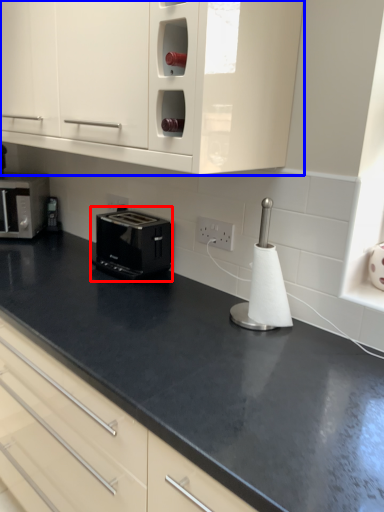
Question: Which object is further to the camera taking this photo, toaster (highlighted by a red box) or cabinetry (highlighted by a blue box)?

Choices:
 (A) toaster
 (B) cabinetry

Answer: (A)